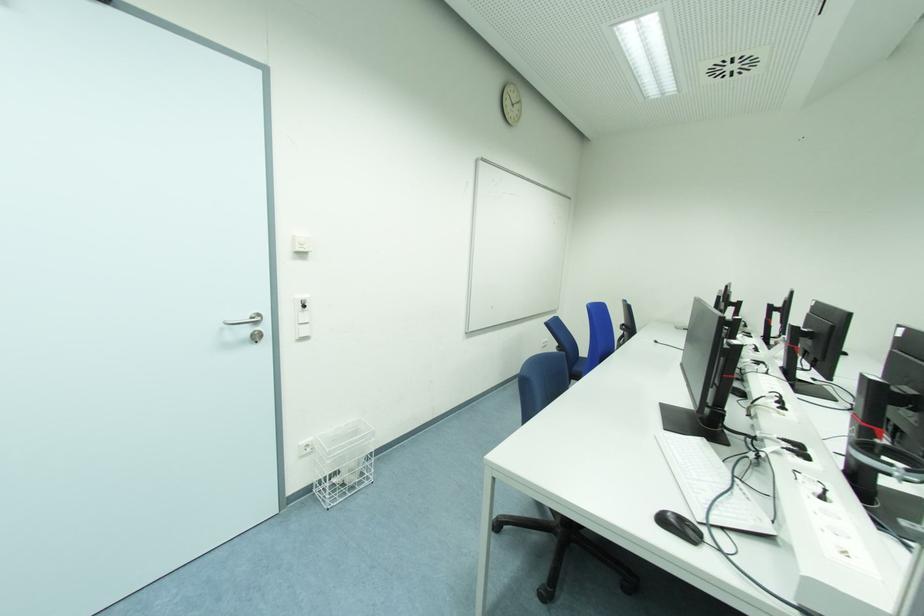
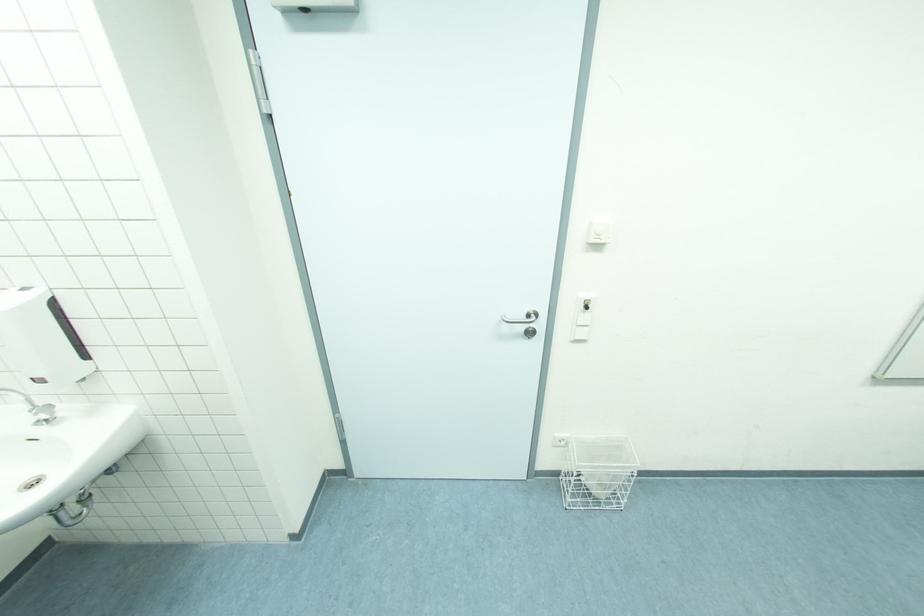
Where in the second image is the point corresponding to [304,445] from the first image?

(560, 437)